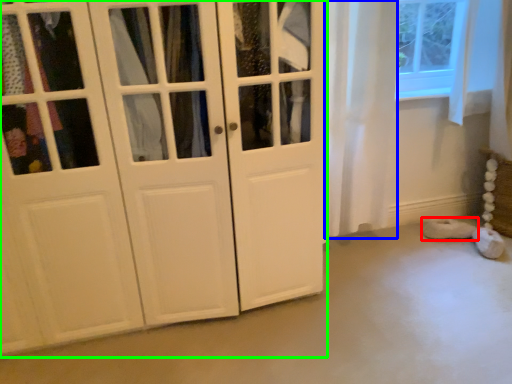
Question: Based on their relative distances, which object is farther from footwear (highlighted by a red box)? Choose from curtain (highlighted by a blue box) and cupboard (highlighted by a green box).

Choices:
 (A) curtain
 (B) cupboard

Answer: (B)